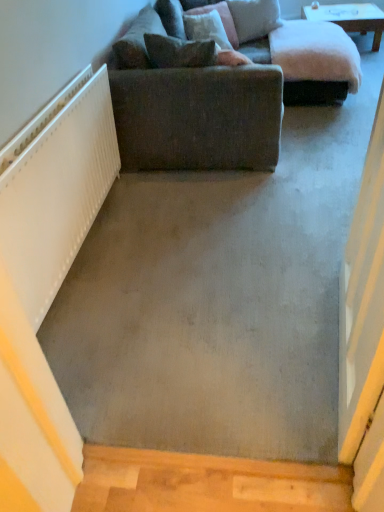
Question: Is textured gray fabric couch at upper center wider or thinner than velvet pink pillow at upper center, arranged as the 3th pillow when viewed from the back?

Choices:
 (A) thin
 (B) wide

Answer: (B)

Question: From the image's perspective, is textured gray fabric couch at upper center located above or below velvet pink pillow at upper center, positioned as the 2th pillow in front-to-back order?

Choices:
 (A) above
 (B) below

Answer: (B)

Question: Which object is the farthest from the white textured radiator at left?

Choices:
 (A) white glossy table at upper center
 (B) fluffy pink pillow at upper center, the first pillow when ordered from back to front
 (C) brown fabric pillow at upper center, arranged as the fourth pillow when viewed from the back
 (D) textured gray fabric couch at upper center
 (E) velvet pink pillow at upper center, positioned as the 2th pillow in front-to-back order

Answer: (A)

Question: Based on their relative distances, which object is nearer to the brown fabric pillow at upper center, marked as the first pillow in a front-to-back arrangement?

Choices:
 (A) white glossy table at upper center
 (B) velvet pink pillow at upper center, arranged as the 3th pillow when viewed from the back
 (C) wooden at bottom
 (D) white textured radiator at left
 (E) fluffy pink pillow at upper center, the first pillow when ordered from back to front

Answer: (D)